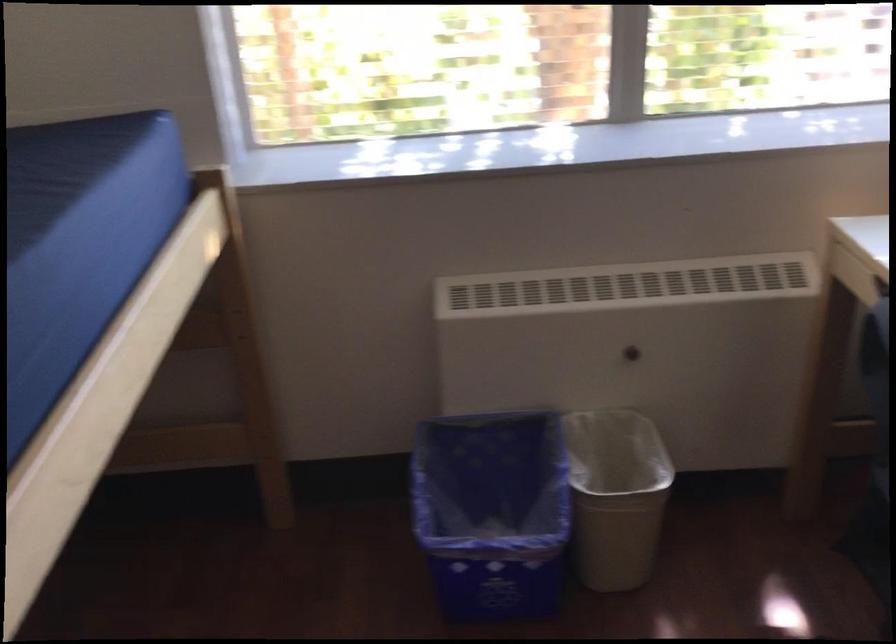
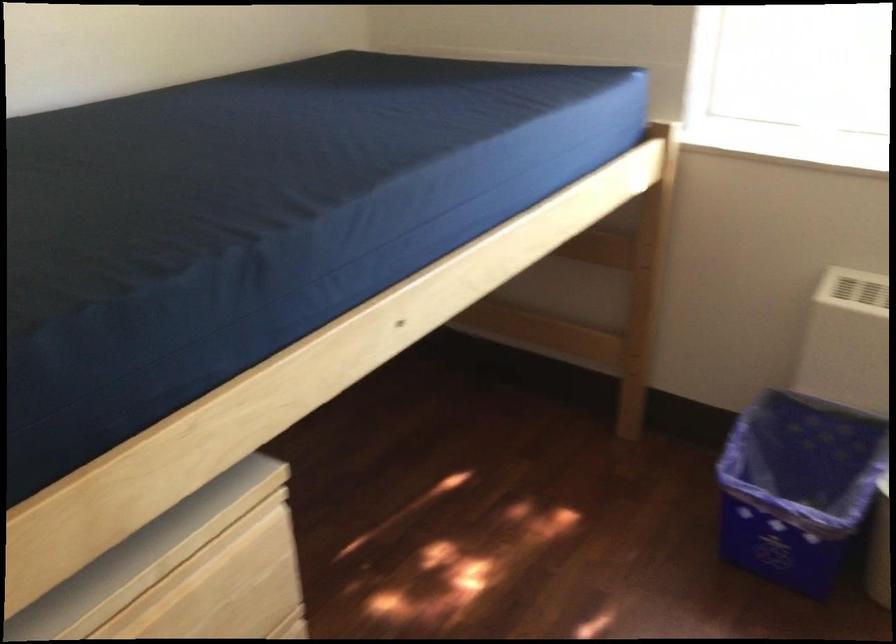
Question: How did the camera likely rotate?

Choices:
 (A) Left
 (B) Right
 (C) Up
 (D) Down

Answer: (A)